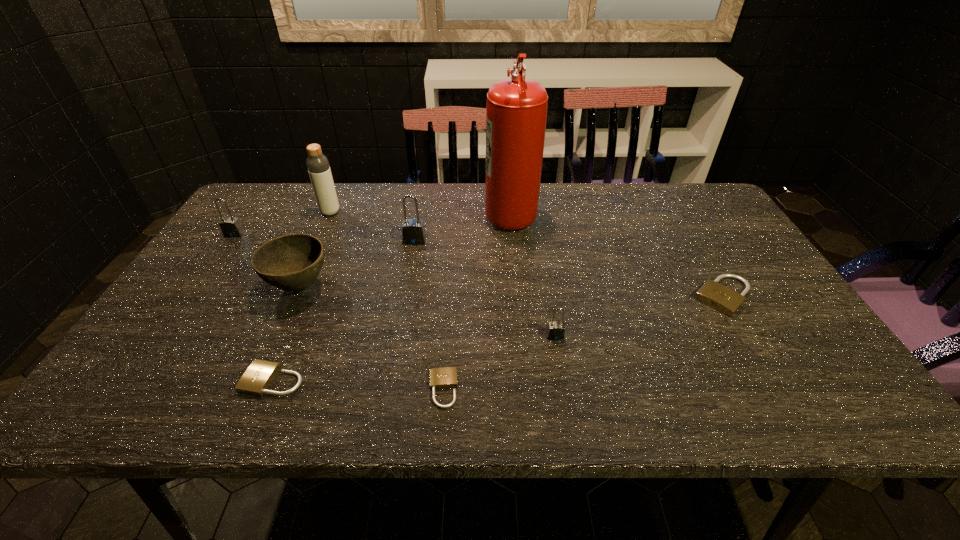
Locate an element on the screen. This screenshot has width=960, height=540. blank space located 0.070m on the back of the bottle is located at coordinates [x=338, y=195].

At what (x,y) coordinates should I click in order to perform the action: click on free region located on the shackle of the tallest padlock. Please return your answer as a coordinate pair (x, y). The height and width of the screenshot is (540, 960). Looking at the image, I should click on (409, 273).

Where is `blank area located on the shackle of the leftmost object`? blank area located on the shackle of the leftmost object is located at coordinates (222, 252).

Locate an element on the screen. The height and width of the screenshot is (540, 960). free region located on the back of the bowl is located at coordinates (321, 240).

Where is `free point located on the shackle of the smallest gray padlock`? The image size is (960, 540). free point located on the shackle of the smallest gray padlock is located at coordinates (560, 362).

Locate an element on the screen. This screenshot has height=540, width=960. vacant area located on the left of the fourth nearest padlock is located at coordinates (548, 296).

The height and width of the screenshot is (540, 960). In order to click on free region located on the left of the leftmost beige padlock in this screenshot , I will do `click(132, 380)`.

The image size is (960, 540). What are the coordinates of `vacant space situated 0.280m on the back of the fourth object from right to left` in the screenshot? It's located at (451, 281).

The height and width of the screenshot is (540, 960). What are the coordinates of `fire extinguisher that is at the far edge` in the screenshot? It's located at (516, 111).

Identify the location of bottle positioned at the far edge. (317, 163).